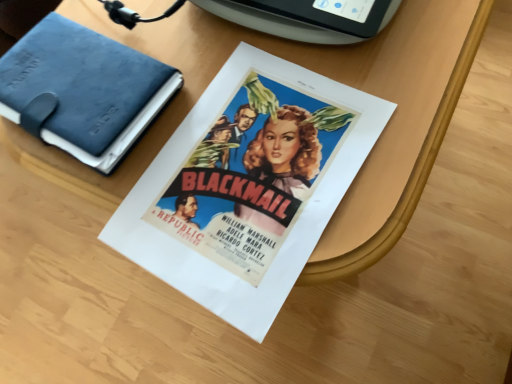
Describe the element at coordinates (84, 90) in the screenshot. The height and width of the screenshot is (384, 512). I see `matte blue notebook at upper left` at that location.

At what (x,y) coordinates should I click in order to perform the action: click on matte blue notebook at upper left. Please return your answer as a coordinate pair (x, y). Image resolution: width=512 pixels, height=384 pixels. Looking at the image, I should click on (84, 90).

Measure the distance between point (41, 21) and camera.

A distance of 60.10 centimeters exists between point (41, 21) and camera.

Find the location of `matte blue notebook at upper left`. matte blue notebook at upper left is located at coordinates (84, 90).